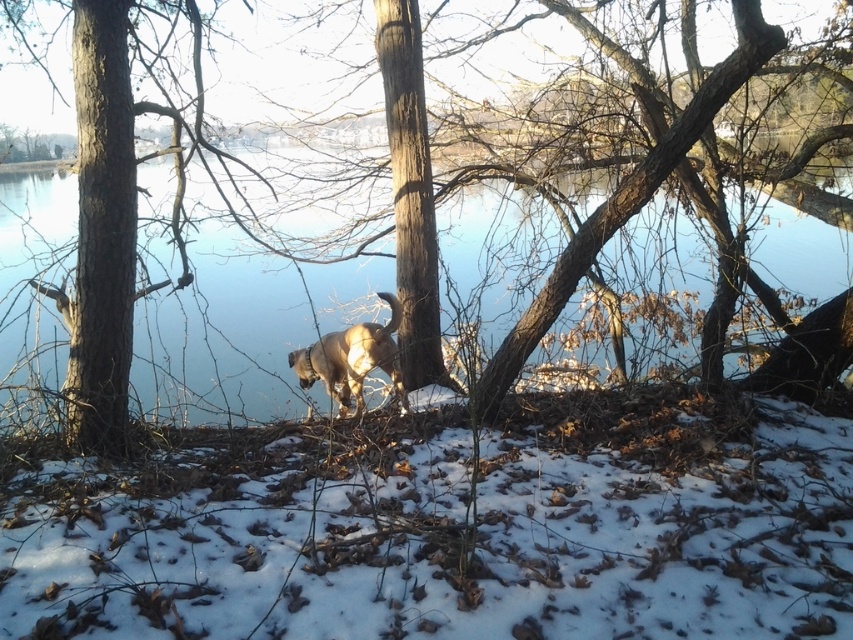
Question: Based on their relative distances, which object is nearer to the clear blue water at center?

Choices:
 (A) brown rough tree at center
 (B) white fluffy snow at lower center
 (C) fuzzy brown dog at center

Answer: (C)

Question: Is white fluffy snow at lower center above fuzzy brown dog at center?

Choices:
 (A) yes
 (B) no

Answer: (B)

Question: Considering the relative positions of white fluffy snow at lower center and fuzzy brown dog at center in the image provided, where is white fluffy snow at lower center located with respect to fuzzy brown dog at center?

Choices:
 (A) left
 (B) right

Answer: (B)

Question: Considering the real-world distances, which object is closest to the brown rough tree at center?

Choices:
 (A) white fluffy snow at lower center
 (B) clear blue water at center

Answer: (A)

Question: Which point appears closest to the camera in this image?

Choices:
 (A) (785, 243)
 (B) (241, 618)
 (C) (119, 316)

Answer: (B)

Question: Does white fluffy snow at lower center have a smaller size compared to fuzzy brown dog at center?

Choices:
 (A) no
 (B) yes

Answer: (A)